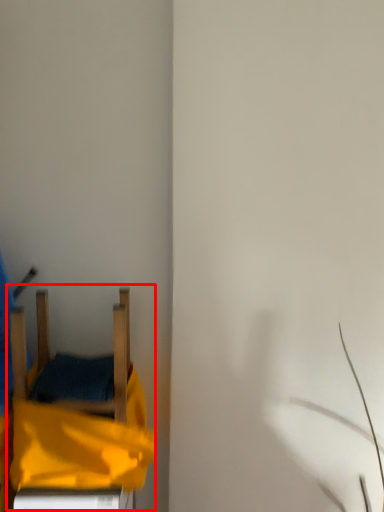
Question: From the image's perspective, where is bed (annotated by the red box) located in relation to furniture in the image?

Choices:
 (A) above
 (B) below

Answer: (B)